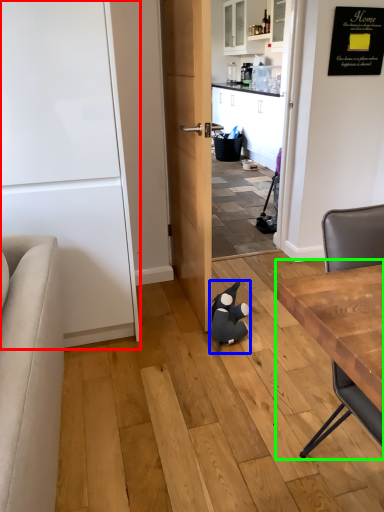
Question: Estimate the real-world distances between objects in this image. Which object is closer to door (highlighted by a red box), animal (highlighted by a blue box) or table (highlighted by a green box)?

Choices:
 (A) animal
 (B) table

Answer: (A)